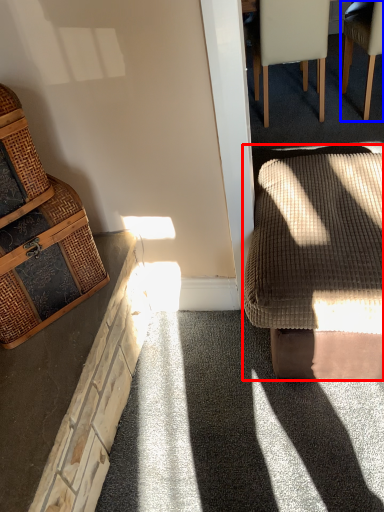
Question: Which point is further to the camera, rocking chair (highlighted by a red box) or chair (highlighted by a blue box)?

Choices:
 (A) rocking chair
 (B) chair

Answer: (B)